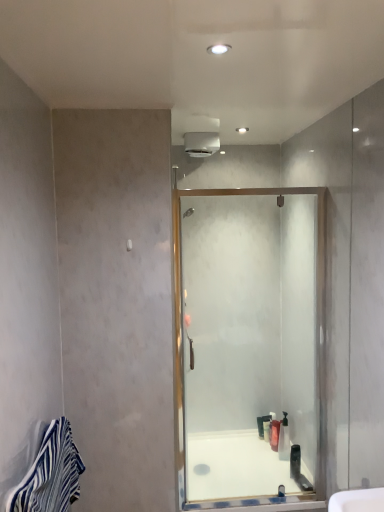
Question: Can you confirm if translucent plastic soap dispenser at center, which is the first toiletry in front-to-back order, is taller than white glossy bath at center?

Choices:
 (A) yes
 (B) no

Answer: (A)

Question: From the image's perspective, is translucent plastic soap dispenser at center, placed as the 3th toiletry when sorted from back to front, above white glossy bath at center?

Choices:
 (A) no
 (B) yes

Answer: (B)

Question: Is translucent plastic soap dispenser at center, placed as the 3th toiletry when sorted from back to front, positioned behind white glossy bath at center?

Choices:
 (A) yes
 (B) no

Answer: (A)

Question: Does translucent plastic soap dispenser at center, which is the first toiletry in front-to-back order, have a smaller size compared to white glossy bath at center?

Choices:
 (A) no
 (B) yes

Answer: (B)

Question: Are translucent plastic soap dispenser at center, which is the first toiletry in front-to-back order, and white glossy bath at center located far from each other?

Choices:
 (A) no
 (B) yes

Answer: (A)

Question: Is translucent plastic bottle at center, marked as the second toiletry in a front-to-back arrangement, to the left or to the right of translucent plastic soap dispenser at center, which is the first toiletry in front-to-back order, in the image?

Choices:
 (A) left
 (B) right

Answer: (A)

Question: Choose the correct answer: Is translucent plastic bottle at center, the second toiletry positioned from the back, inside translucent plastic soap dispenser at center, placed as the 3th toiletry when sorted from back to front, or outside it?

Choices:
 (A) inside
 (B) outside

Answer: (B)

Question: From their relative heights in the image, would you say translucent plastic bottle at center, marked as the second toiletry in a front-to-back arrangement, is taller or shorter than translucent plastic soap dispenser at center, placed as the 3th toiletry when sorted from back to front?

Choices:
 (A) short
 (B) tall

Answer: (A)

Question: Is translucent plastic bottle at center, marked as the second toiletry in a front-to-back arrangement, wider or thinner than translucent plastic soap dispenser at center, placed as the 3th toiletry when sorted from back to front?

Choices:
 (A) thin
 (B) wide

Answer: (A)

Question: From the image's perspective, is blue striped towel at lower left located above or below translucent plastic bottle at lower center, which ranks as the 1th toiletry in back-to-front order?

Choices:
 (A) below
 (B) above

Answer: (B)

Question: Considering the relative positions of blue striped towel at lower left and translucent plastic bottle at lower center, which ranks as the 1th toiletry in back-to-front order, in the image provided, is blue striped towel at lower left to the left or to the right of translucent plastic bottle at lower center, which ranks as the 1th toiletry in back-to-front order,?

Choices:
 (A) left
 (B) right

Answer: (A)

Question: In terms of width, does blue striped towel at lower left look wider or thinner when compared to translucent plastic bottle at lower center, which ranks as the 3th toiletry in front-to-back order?

Choices:
 (A) thin
 (B) wide

Answer: (B)

Question: Is blue striped towel at lower left in front of or behind translucent plastic bottle at lower center, which ranks as the 1th toiletry in back-to-front order, in the image?

Choices:
 (A) behind
 (B) front

Answer: (B)

Question: From their relative heights in the image, would you say translucent plastic bottle at center, the second toiletry positioned from the back, is taller or shorter than translucent plastic bottle at lower center, which ranks as the 3th toiletry in front-to-back order?

Choices:
 (A) tall
 (B) short

Answer: (A)

Question: From the image's perspective, is translucent plastic bottle at center, the second toiletry positioned from the back, above or below translucent plastic bottle at lower center, which ranks as the 3th toiletry in front-to-back order?

Choices:
 (A) above
 (B) below

Answer: (A)